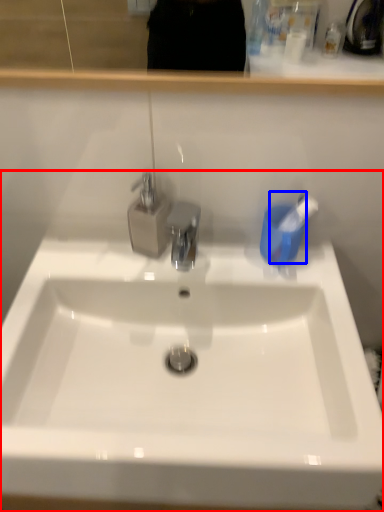
Question: Which of the following is the farthest to the observer, sink (highlighted by a red box) or toothbrush (highlighted by a blue box)?

Choices:
 (A) sink
 (B) toothbrush

Answer: (B)